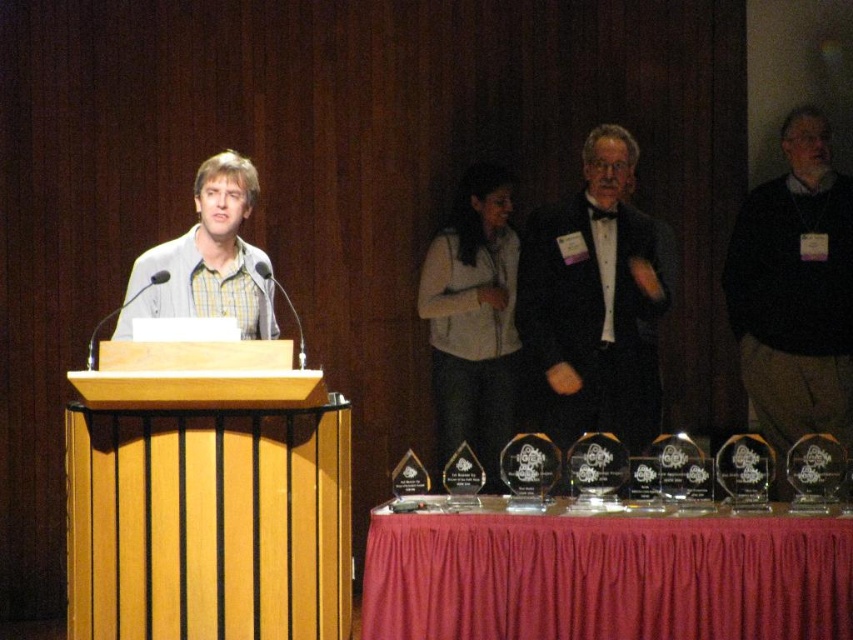
Question: Does black satin tuxedo at center appear on the left side of yellow-green plaid shirt at center?

Choices:
 (A) yes
 (B) no

Answer: (B)

Question: Where is black satin tuxedo at center located in relation to white fleece vest at center in the image?

Choices:
 (A) left
 (B) right

Answer: (B)

Question: Which object is farther from the camera taking this photo?

Choices:
 (A) black sweater at right
 (B) white fleece vest at center
 (C) black satin tuxedo at center

Answer: (B)

Question: Which point is closer to the camera taking this photo?

Choices:
 (A) (779, 355)
 (B) (614, 349)
 (C) (218, 285)

Answer: (C)

Question: Among these objects, which one is farthest from the camera?

Choices:
 (A) yellow-green plaid shirt at center
 (B) black satin tuxedo at center
 (C) white fleece vest at center

Answer: (C)

Question: From the image, what is the correct spatial relationship of black satin tuxedo at center in relation to yellow-green plaid shirt at center?

Choices:
 (A) below
 (B) above

Answer: (B)